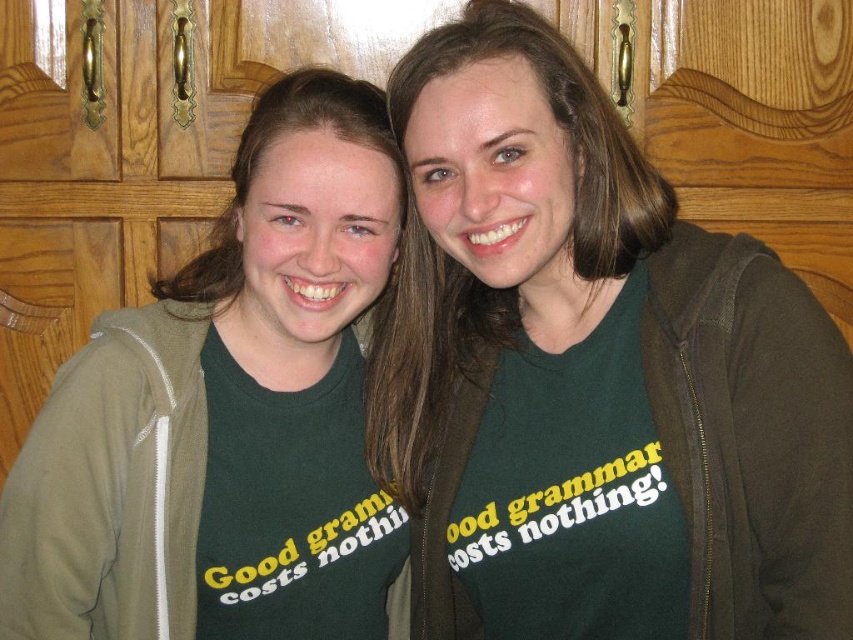
Between green matte t-shirt at center and green jersey at right, which one has less height?

green jersey at right

Is green matte t-shirt at center to the right of green jersey at right from the viewer's perspective?

Incorrect, green matte t-shirt at center is not on the right side of green jersey at right.

Is point (47, 445) closer to camera compared to point (468, 600)?

Yes, it is in front of point (468, 600).

Find the location of `green matte t-shirt at center`. green matte t-shirt at center is located at coordinates (228, 413).